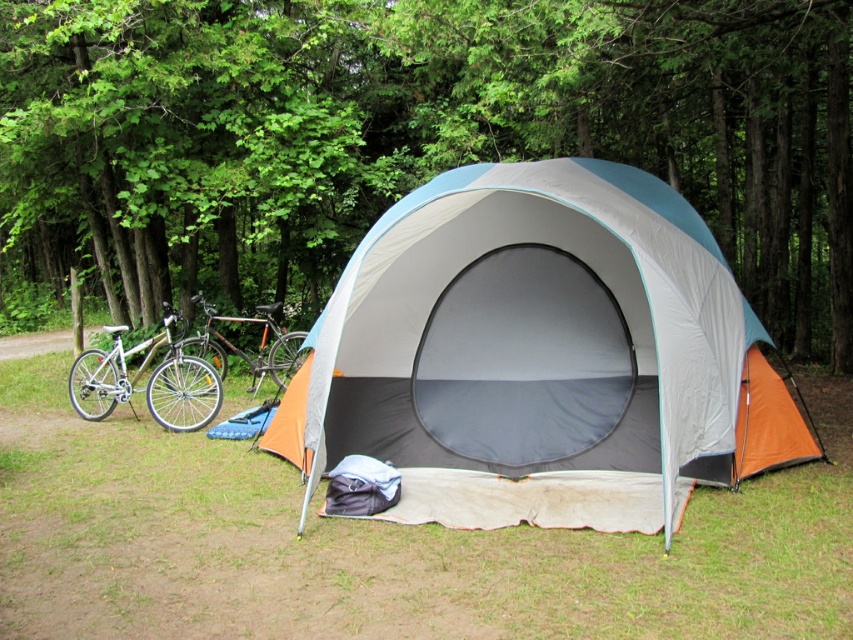
Question: Can you confirm if green grass at lower center is wider than silver metallic bicycle at left?

Choices:
 (A) yes
 (B) no

Answer: (A)

Question: In this image, where is green leafy tree at center located relative to shiny metallic bicycle at left?

Choices:
 (A) right
 (B) left

Answer: (B)

Question: Which object appears closest to the camera in this image?

Choices:
 (A) silver metallic bicycle at left
 (B) green leafy tree at center
 (C) orange fabric tent at center

Answer: (C)

Question: Which point is farther to the camera?

Choices:
 (A) (355, 120)
 (B) (288, 372)
 (C) (596, 308)
 (D) (337, 625)

Answer: (A)

Question: Which of these objects is positioned closest to the silver metallic bicycle at left?

Choices:
 (A) shiny metallic bicycle at left
 (B) green leafy tree at center

Answer: (A)

Question: Is green leafy tree at center positioned behind shiny metallic bicycle at left?

Choices:
 (A) yes
 (B) no

Answer: (B)